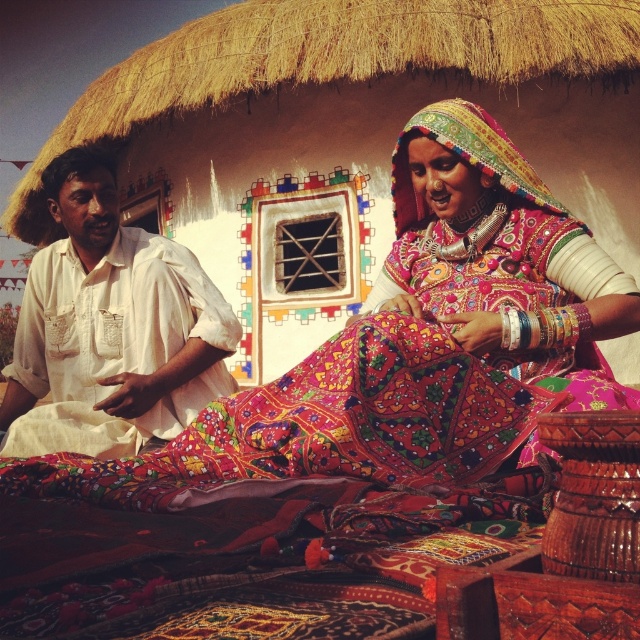
This screenshot has width=640, height=640. Describe the element at coordinates (412, 346) in the screenshot. I see `embroidered fabric dress at center` at that location.

How far apart are embroidered fabric dress at center and white cotton shirt at left?

A distance of 13.48 feet exists between embroidered fabric dress at center and white cotton shirt at left.

Between point (426, 396) and point (90, 253), which one is positioned behind?

Positioned behind is point (90, 253).

The width and height of the screenshot is (640, 640). In order to click on embroidered fabric dress at center in this screenshot , I will do tap(412, 346).